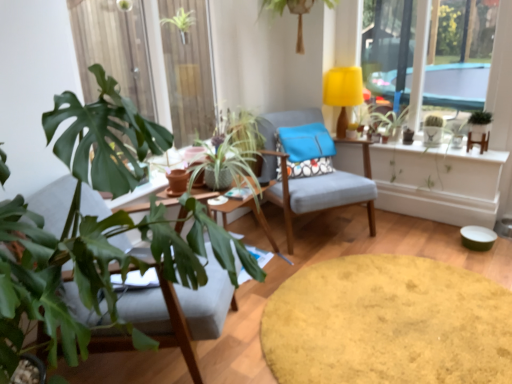
The height and width of the screenshot is (384, 512). Identify the location of vacant space underneath velvet yellow rug at center, placed as the 2th round table when sorted from top to bottom (from a real-world perspective). (371, 313).